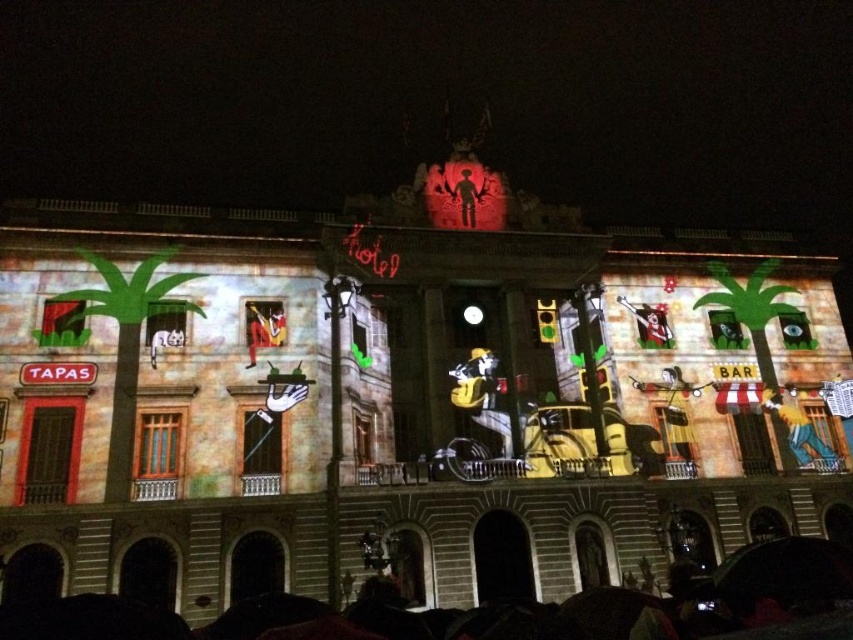
Question: Which point is closer to the camera taking this photo?

Choices:
 (A) (767, 396)
 (B) (467, 221)

Answer: (B)

Question: Can you confirm if blue fabric person at lower right is positioned above silhouette figure at center?

Choices:
 (A) yes
 (B) no

Answer: (B)

Question: Which object is farther from the camera taking this photo?

Choices:
 (A) blue fabric person at lower right
 (B) silhouette figure at center

Answer: (B)

Question: In this image, where is blue fabric person at lower right located relative to silhouette figure at center?

Choices:
 (A) right
 (B) left

Answer: (A)

Question: Does blue fabric person at lower right appear under silhouette figure at center?

Choices:
 (A) no
 (B) yes

Answer: (B)